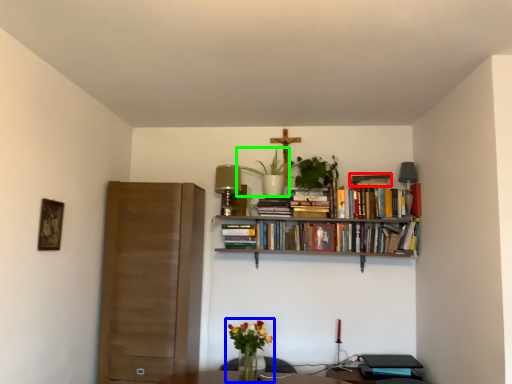
Question: Which object is the farthest from book (highlighted by a red box)? Choose among these: floral arrangement (highlighted by a blue box) or plant (highlighted by a green box).

Choices:
 (A) floral arrangement
 (B) plant

Answer: (A)